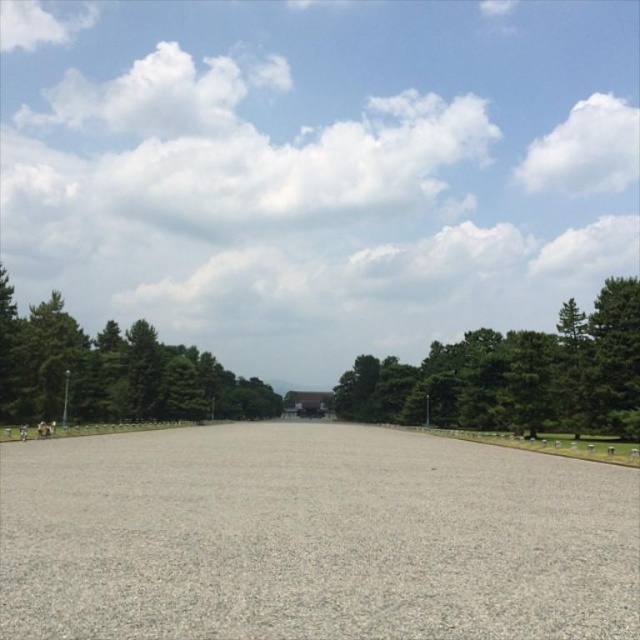
Question: Can you confirm if green leafy tree at center is positioned to the right of green leafy tree at upper center?

Choices:
 (A) yes
 (B) no

Answer: (A)

Question: Can you confirm if green leafy tree at center is positioned above green leafy tree at upper center?

Choices:
 (A) no
 (B) yes

Answer: (B)

Question: Which of the following is the farthest from the observer?

Choices:
 (A) (131, 394)
 (B) (502, 420)

Answer: (A)

Question: Estimate the real-world distances between objects in this image. Which object is closer to the green leafy tree at center?

Choices:
 (A) green leafy tree at upper center
 (B) gray gravel at center

Answer: (A)

Question: Is gray gravel at center wider than green leafy tree at center?

Choices:
 (A) no
 (B) yes

Answer: (B)

Question: Which point is farther to the camera?

Choices:
 (A) green leafy tree at center
 (B) gray gravel at center

Answer: (A)